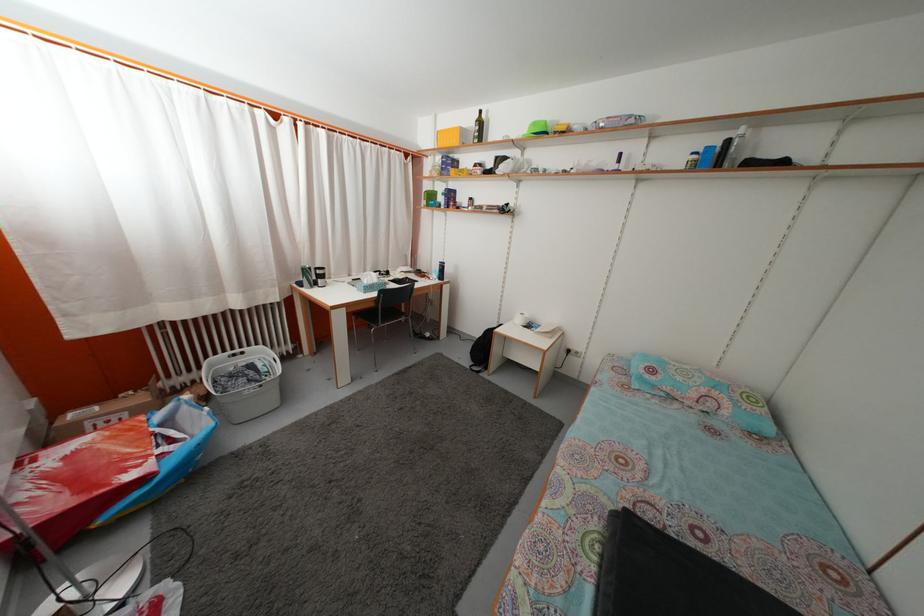
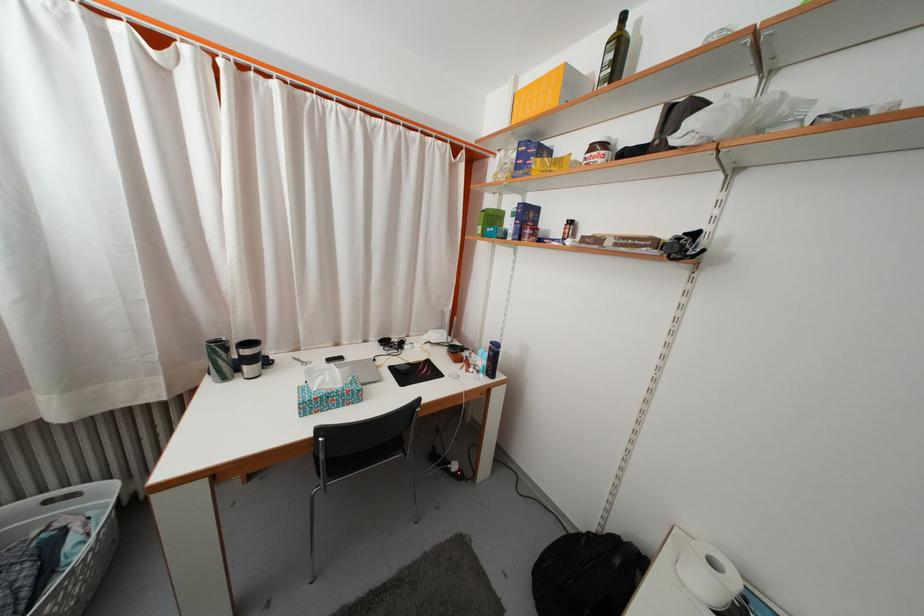
Find the pixel in the second image that matches point 436,203 in the first image.

(500, 225)